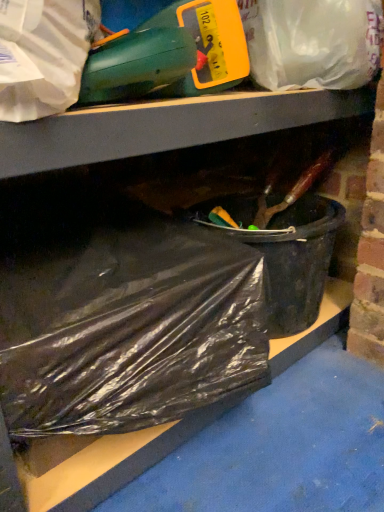
Question: Should I look upward or downward to see translucent plastic bag at upper center, which is the 2th plastic bag in bottom-to-top order?

Choices:
 (A) down
 (B) up

Answer: (B)

Question: Does black plastic bag at lower left, positioned as the 2th plastic bag in top-to-bottom order, appear on the right side of translucent plastic bag at upper center, the first plastic bag when ordered from top to bottom?

Choices:
 (A) no
 (B) yes

Answer: (A)

Question: Is black plastic bag at lower left, the first plastic bag ordered from the bottom, wider than translucent plastic bag at upper center, the first plastic bag when ordered from top to bottom?

Choices:
 (A) yes
 (B) no

Answer: (A)

Question: Can you confirm if black plastic bag at lower left, positioned as the 2th plastic bag in top-to-bottom order, is thinner than translucent plastic bag at upper center, which is the 2th plastic bag in bottom-to-top order?

Choices:
 (A) yes
 (B) no

Answer: (B)

Question: Is black plastic bag at lower left, positioned as the 2th plastic bag in top-to-bottom order, surrounding translucent plastic bag at upper center, which is the 2th plastic bag in bottom-to-top order?

Choices:
 (A) no
 (B) yes

Answer: (A)

Question: From a real-world perspective, is black plastic bag at lower left, positioned as the 2th plastic bag in top-to-bottom order, physically above translucent plastic bag at upper center, the first plastic bag when ordered from top to bottom?

Choices:
 (A) yes
 (B) no

Answer: (B)

Question: From the image's perspective, is black plastic bag at lower left, the first plastic bag ordered from the bottom, over translucent plastic bag at upper center, which is the 2th plastic bag in bottom-to-top order?

Choices:
 (A) no
 (B) yes

Answer: (A)

Question: Is the surface of black plastic bucket at lower right in direct contact with translucent plastic bag at upper center, the first plastic bag when ordered from top to bottom?

Choices:
 (A) no
 (B) yes

Answer: (A)

Question: Does black plastic bucket at lower right have a smaller size compared to translucent plastic bag at upper center, which is the 2th plastic bag in bottom-to-top order?

Choices:
 (A) yes
 (B) no

Answer: (B)

Question: Is black plastic bucket at lower right oriented towards translucent plastic bag at upper center, which is the 2th plastic bag in bottom-to-top order?

Choices:
 (A) yes
 (B) no

Answer: (B)

Question: Would you say black plastic bucket at lower right is a long distance from translucent plastic bag at upper center, which is the 2th plastic bag in bottom-to-top order?

Choices:
 (A) yes
 (B) no

Answer: (B)

Question: Is black plastic bucket at lower right positioned before translucent plastic bag at upper center, which is the 2th plastic bag in bottom-to-top order?

Choices:
 (A) no
 (B) yes

Answer: (A)

Question: Is black plastic bucket at lower right facing away from translucent plastic bag at upper center, the first plastic bag when ordered from top to bottom?

Choices:
 (A) yes
 (B) no

Answer: (B)

Question: Does translucent plastic bag at upper center, the first plastic bag when ordered from top to bottom, come behind black plastic bag at lower left, positioned as the 2th plastic bag in top-to-bottom order?

Choices:
 (A) yes
 (B) no

Answer: (A)